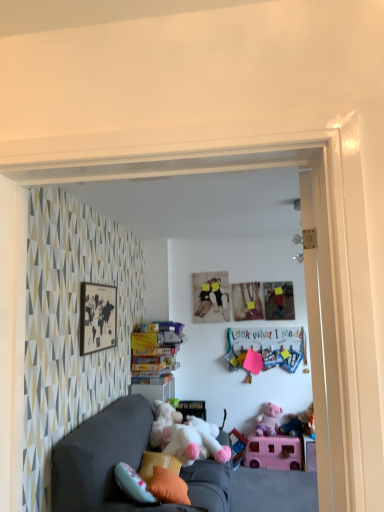
This screenshot has height=512, width=384. Find the location of `vacant space situated above pink plastic toy car at lower right, which is the 2th toy in front-to-back order (from a real-world perspective)`. vacant space situated above pink plastic toy car at lower right, which is the 2th toy in front-to-back order (from a real-world perspective) is located at coordinates (271, 435).